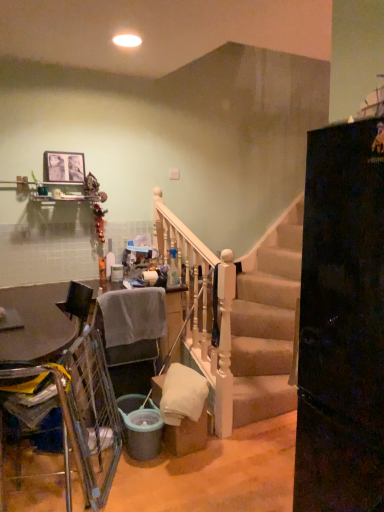
Question: Considering their positions, is yellow fabric armchair at lower left, which ranks as the second armchair in back-to-front order, located in front of or behind matte wooden picture frame at upper left?

Choices:
 (A) behind
 (B) front

Answer: (B)

Question: Is yellow fabric armchair at lower left, which is the first armchair in front-to-back order, bigger or smaller than matte wooden picture frame at upper left?

Choices:
 (A) small
 (B) big

Answer: (B)

Question: Which object is positioned closest to the yellow fabric armchair at lower left, which ranks as the second armchair in back-to-front order?

Choices:
 (A) gray fabric chair at lower left, which ranks as the first armchair in back-to-front order
 (B) metallic silver table at lower left
 (C) matte wooden picture frame at upper left

Answer: (B)

Question: Estimate the real-world distances between objects in this image. Which object is farther from the yellow fabric armchair at lower left, which ranks as the second armchair in back-to-front order?

Choices:
 (A) gray fabric chair at lower left, arranged as the 2th armchair when viewed from the front
 (B) metallic silver table at lower left
 (C) matte wooden picture frame at upper left

Answer: (C)